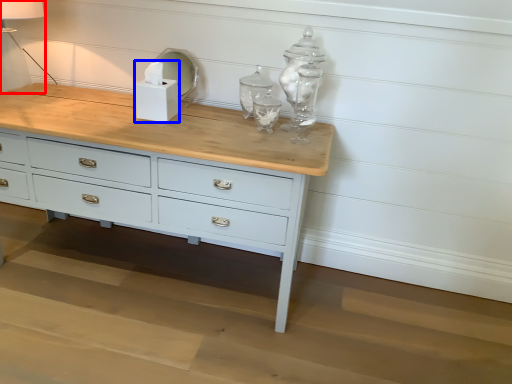
Question: Which object is closer to the camera taking this photo, table lamp (highlighted by a red box) or candle holder (highlighted by a blue box)?

Choices:
 (A) table lamp
 (B) candle holder

Answer: (A)